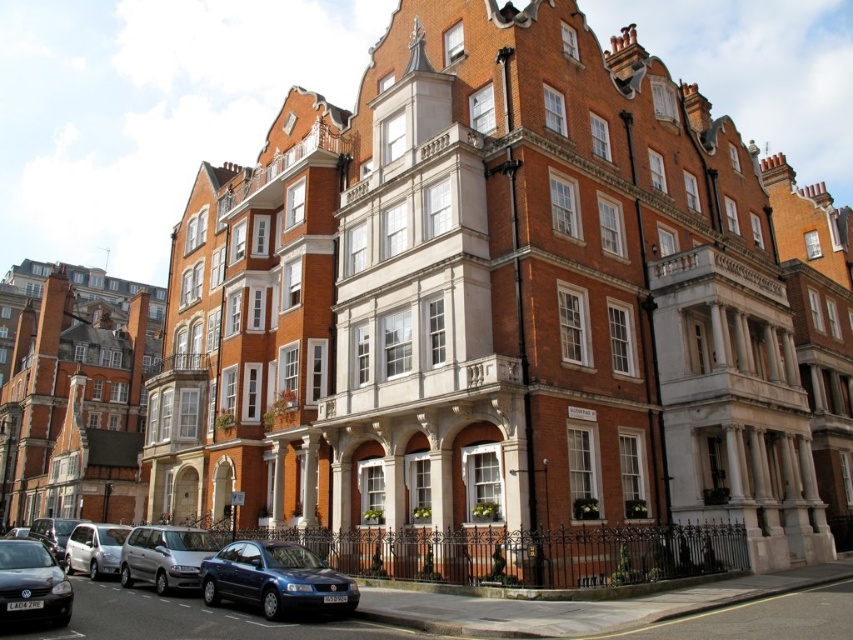
Question: Can you confirm if matte blue sedan at lower left is positioned above matte black car at lower left?

Choices:
 (A) yes
 (B) no

Answer: (B)

Question: Among these points, which one is nearest to the camera?

Choices:
 (A) (195, 545)
 (B) (312, 589)
 (C) (28, 577)
 (D) (68, 536)

Answer: (C)

Question: Which object appears farthest from the camera in this image?

Choices:
 (A) satin silver van at lower left
 (B) silver metallic car at lower left
 (C) matte black car at lower left
 (D) metallic blue sedan at center

Answer: (B)

Question: Can you confirm if metallic blue sedan at center is positioned below matte black car at lower left?

Choices:
 (A) yes
 (B) no

Answer: (A)

Question: Where is satin silver van at lower left located in relation to silver metallic car at lower left in the image?

Choices:
 (A) left
 (B) right

Answer: (B)

Question: Which object appears farthest from the camera in this image?

Choices:
 (A) matte black car at lower left
 (B) satin silver van at lower left
 (C) matte blue sedan at lower left

Answer: (B)